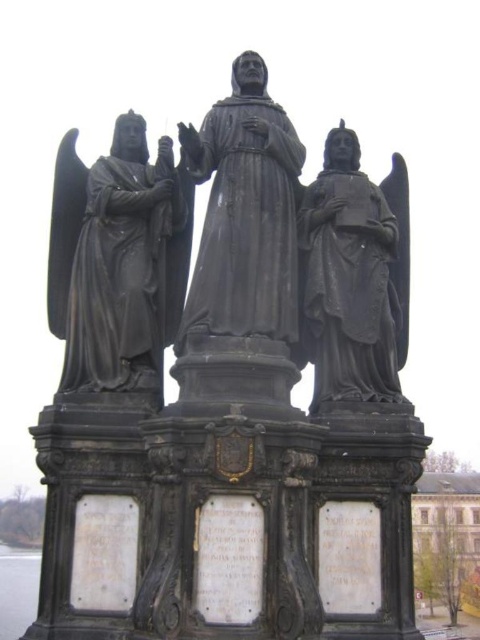
Question: Which point is farther to the camera?

Choices:
 (A) matte black statue at right
 (B) black stone statue at center
 (C) black polished statue at left

Answer: (A)

Question: Where is black polished statue at left located in relation to matte black statue at right in the image?

Choices:
 (A) above
 (B) below

Answer: (A)

Question: Which object is closer to the camera taking this photo?

Choices:
 (A) black polished statue at left
 (B) matte black statue at right
 (C) black stone statue at center

Answer: (C)

Question: Can you confirm if black polished statue at left is bigger than matte black statue at right?

Choices:
 (A) yes
 (B) no

Answer: (A)

Question: Observing the image, what is the correct spatial positioning of black stone statue at center in reference to matte black statue at right?

Choices:
 (A) below
 (B) above

Answer: (B)

Question: Estimate the real-world distances between objects in this image. Which object is farther from the black stone statue at center?

Choices:
 (A) matte black statue at right
 (B) black polished statue at left

Answer: (B)